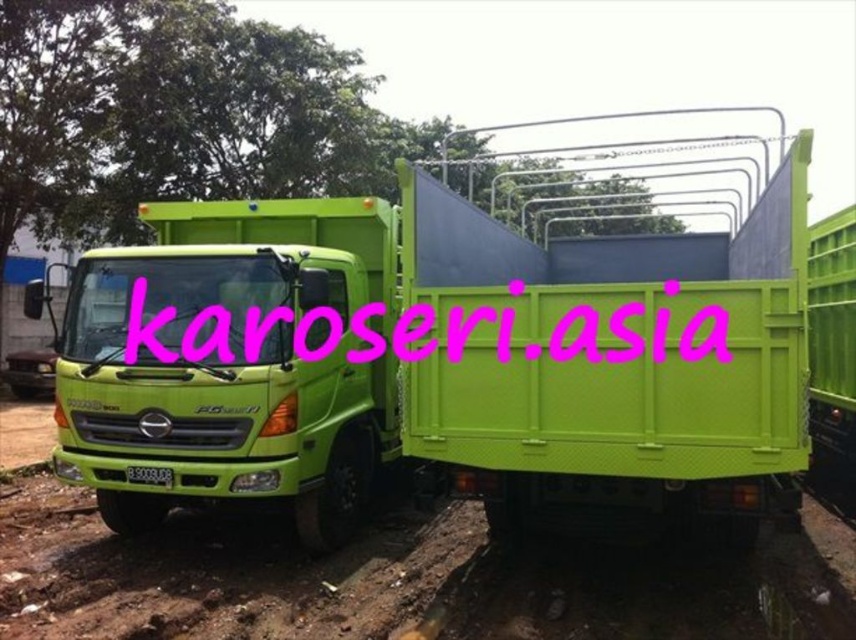
Question: From the image, what is the correct spatial relationship of lime green plastic truck at center in relation to pink text at center?

Choices:
 (A) right
 (B) left

Answer: (B)

Question: Is the position of lime green plastic truck at center more distant than that of pink text at center?

Choices:
 (A) no
 (B) yes

Answer: (B)

Question: Is lime green plastic truck at center smaller than pink text at center?

Choices:
 (A) no
 (B) yes

Answer: (B)

Question: Which point appears farthest from the camera in this image?

Choices:
 (A) (221, 323)
 (B) (628, 621)
 (C) (623, 310)

Answer: (A)

Question: Which of the following is the farthest from the observer?

Choices:
 (A) green matte dirt track at lower left
 (B) lime green plastic truck at center
 (C) pink text at center

Answer: (B)

Question: Which of the following is the closest to the observer?

Choices:
 (A) pink text at center
 (B) lime green plastic truck at center
 (C) green matte dirt track at lower left

Answer: (C)